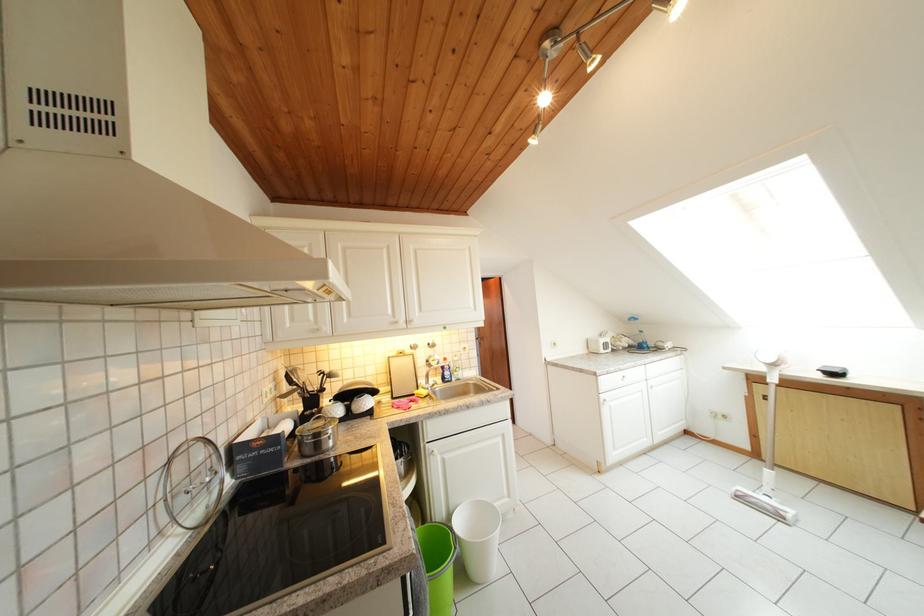
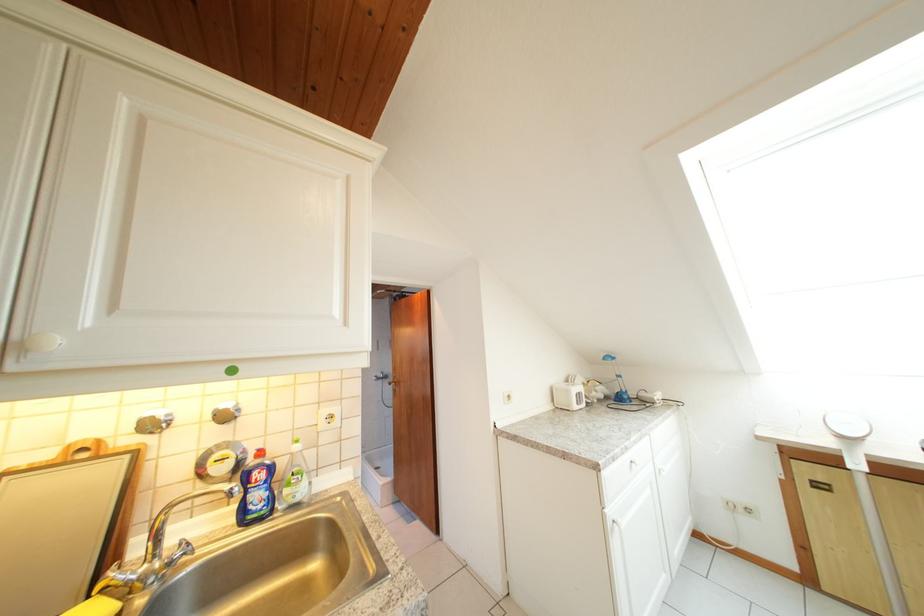
Locate, in the second image, the point that corresponds to (x=489, y=349) in the first image.

(403, 395)